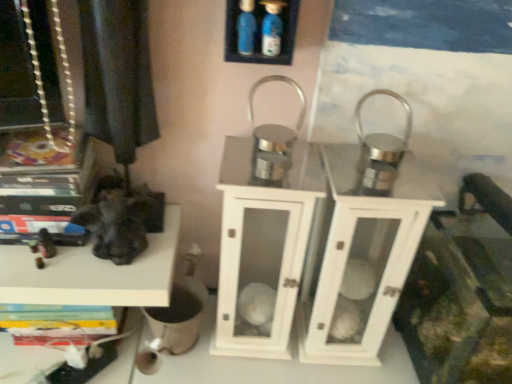
Question: Is blue plastic bottles at upper center, acting as the 2th shelf starting from the left, facing away from white glossy lantern at center?

Choices:
 (A) no
 (B) yes

Answer: (A)

Question: Can you confirm if blue plastic bottles at upper center, the second shelf when ordered from back to front, is taller than white glossy lantern at center?

Choices:
 (A) no
 (B) yes

Answer: (A)

Question: Can you confirm if blue plastic bottles at upper center, the first shelf in the right-to-left sequence, is positioned to the right of white glossy lantern at center?

Choices:
 (A) yes
 (B) no

Answer: (B)

Question: Is the depth of blue plastic bottles at upper center, which is the first shelf from top to bottom, greater than that of white glossy lantern at center?

Choices:
 (A) yes
 (B) no

Answer: (B)

Question: From a real-world perspective, is blue plastic bottles at upper center, marked as the 1th shelf in a front-to-back arrangement, on top of white glossy lantern at center?

Choices:
 (A) no
 (B) yes

Answer: (B)

Question: Is blue plastic bottles at upper center, which is the 2th shelf in bottom-to-top order, to the left of white glossy lantern at center from the viewer's perspective?

Choices:
 (A) yes
 (B) no

Answer: (A)

Question: Considering the relative positions of black matte statue at left, which is the first shelf in back-to-front order, and blue plastic bottles at upper center, acting as the 2th shelf starting from the left, in the image provided, is black matte statue at left, which is the first shelf in back-to-front order, behind blue plastic bottles at upper center, acting as the 2th shelf starting from the left,?

Choices:
 (A) yes
 (B) no

Answer: (A)

Question: Could you tell me if black matte statue at left, the second shelf in the right-to-left sequence, is turned towards blue plastic bottles at upper center, the second shelf when ordered from back to front?

Choices:
 (A) yes
 (B) no

Answer: (B)

Question: Considering the relative sizes of black matte statue at left, which is the first shelf from bottom to top, and blue plastic bottles at upper center, the second shelf when ordered from back to front, in the image provided, is black matte statue at left, which is the first shelf from bottom to top, thinner than blue plastic bottles at upper center, the second shelf when ordered from back to front,?

Choices:
 (A) yes
 (B) no

Answer: (B)

Question: Is black matte statue at left, which is the first shelf from bottom to top, positioned beyond the bounds of blue plastic bottles at upper center, the first shelf in the right-to-left sequence?

Choices:
 (A) no
 (B) yes

Answer: (B)

Question: Is black matte statue at left, the first shelf when ordered from left to right, smaller than blue plastic bottles at upper center, the first shelf in the right-to-left sequence?

Choices:
 (A) no
 (B) yes

Answer: (A)

Question: Does black matte statue at left, the first shelf when ordered from left to right, contain blue plastic bottles at upper center, which is the 2th shelf in bottom-to-top order?

Choices:
 (A) yes
 (B) no

Answer: (B)

Question: Does white glossy lantern at center turn towards black matte statue at left, the first shelf when ordered from left to right?

Choices:
 (A) no
 (B) yes

Answer: (A)